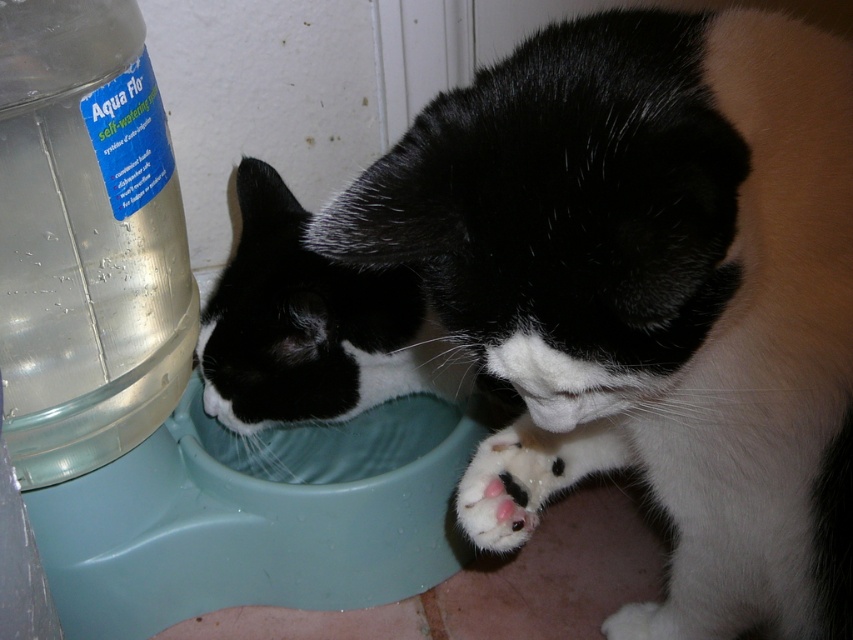
Question: Which of the following is the closest to the observer?

Choices:
 (A) (498, 442)
 (B) (135, 131)

Answer: (A)

Question: Is transparent plastic bottle at left closer to the viewer compared to white fur paw at lower center?

Choices:
 (A) no
 (B) yes

Answer: (B)

Question: Which object appears farthest from the camera in this image?

Choices:
 (A) white fur paw at lower center
 (B) transparent plastic bottle at left

Answer: (A)

Question: Is transparent plastic bottle at left smaller than white fur paw at lower center?

Choices:
 (A) no
 (B) yes

Answer: (A)

Question: Is transparent plastic bottle at left wider than white fur paw at lower center?

Choices:
 (A) yes
 (B) no

Answer: (A)